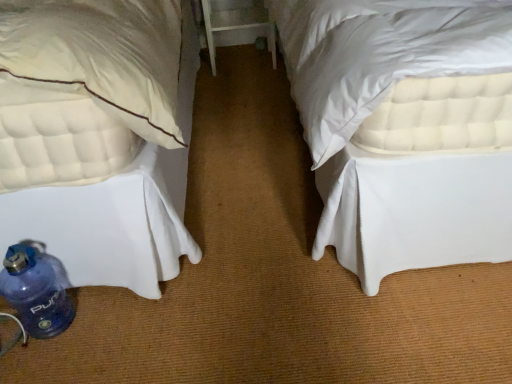
This screenshot has height=384, width=512. I want to click on vacant area that lies to the right of blue plastic water bottle at lower left, so click(102, 320).